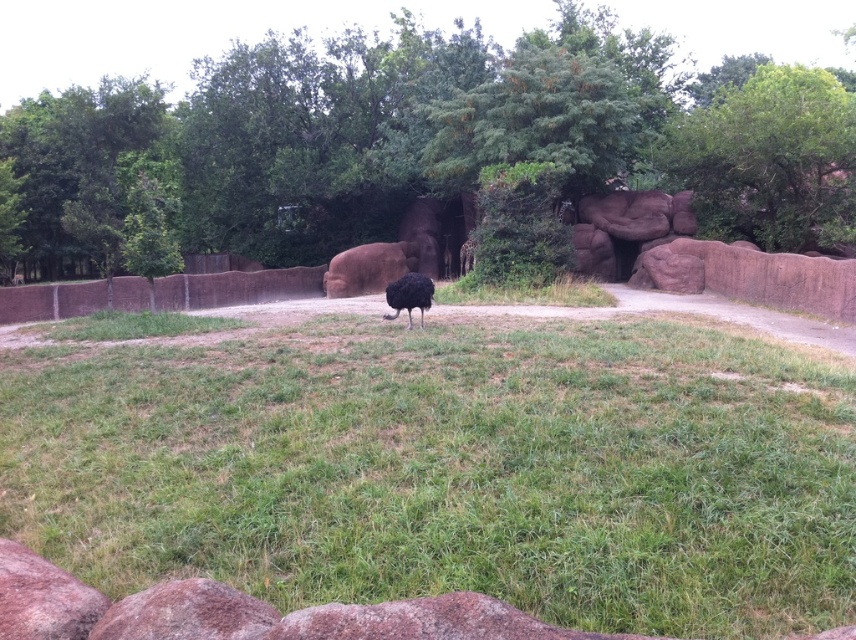
In the scene shown: How far apart are green grassy at center and green leafy tree at upper right?

green grassy at center is 6.20 meters from green leafy tree at upper right.

Who is positioned more to the left, green grassy at center or green leafy tree at upper right?

From the viewer's perspective, green grassy at center appears more on the left side.

Does point (806, 385) lie behind point (694, 141)?

No, it is not.

Locate an element on the screen. Image resolution: width=856 pixels, height=640 pixels. green grassy at center is located at coordinates point(452,468).

Between brown rough stone at lower left and rustic stone at lower left, which one is positioned lower?

rustic stone at lower left is below.

Between brown rough stone at lower left and rustic stone at lower left, which one is positioned higher?

brown rough stone at lower left is above.

Between point (110, 634) and point (36, 609), which one is positioned in front?

Point (110, 634) is more forward.

Locate an element on the screen. This screenshot has height=640, width=856. brown rough stone at lower left is located at coordinates (186, 612).

Who is taller, rustic stone at lower left or black feathered ostrich at center?

With more height is black feathered ostrich at center.

Which is more to the left, rustic stone at lower left or black feathered ostrich at center?

From the viewer's perspective, rustic stone at lower left appears more on the left side.

Based on the photo, measure the distance between rustic stone at lower left and camera.

rustic stone at lower left is 1.14 meters away from camera.

Locate an element on the screen. The image size is (856, 640). rustic stone at lower left is located at coordinates (43, 596).